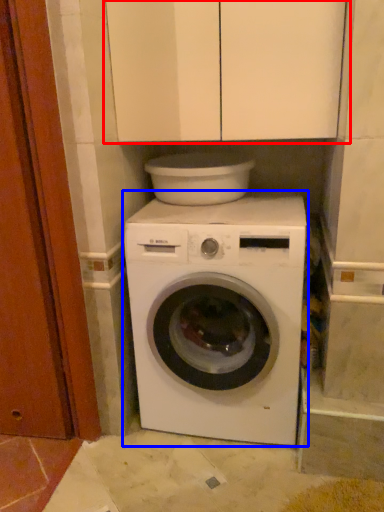
Question: Among these objects, which one is farthest to the camera, cabinetry (highlighted by a red box) or washing machine (highlighted by a blue box)?

Choices:
 (A) cabinetry
 (B) washing machine

Answer: (B)